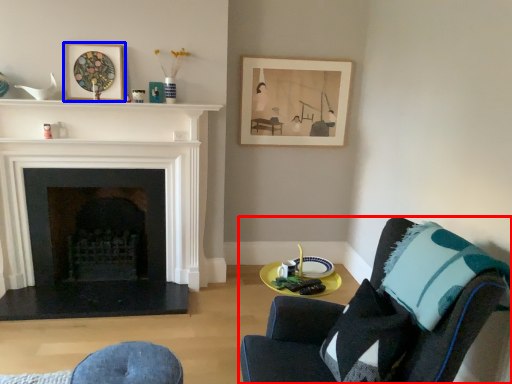
Question: Among these objects, which one is nearest to the camera, chair (highlighted by a red box) or picture frame (highlighted by a blue box)?

Choices:
 (A) chair
 (B) picture frame

Answer: (A)